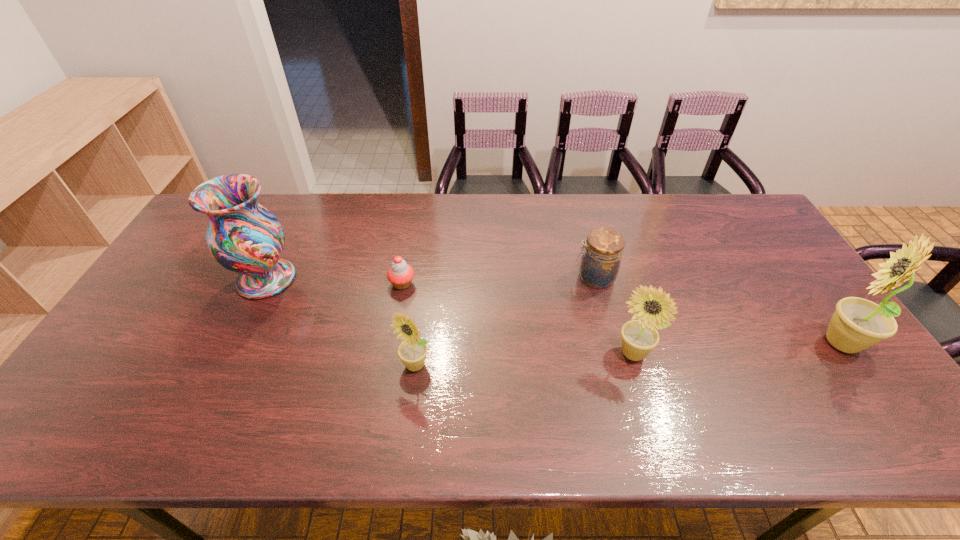
Locate an element on the screen. The image size is (960, 540). vacant area between the second shortest object and the leftmost sunflower is located at coordinates 505,321.

What are the coordinates of `unoccupied position between the second sunflower from left to right and the vase` in the screenshot? It's located at (449, 316).

This screenshot has width=960, height=540. Find the location of `object that can be found as the second closest to the third tallest object`. object that can be found as the second closest to the third tallest object is located at coordinates (857, 324).

At what (x,y) coordinates should I click in order to perform the action: click on object that is the closest one to the vase. Please return your answer as a coordinate pair (x, y). This screenshot has width=960, height=540. Looking at the image, I should click on (400, 274).

Where is `sunflower identified as the second closest to the shortest object`? sunflower identified as the second closest to the shortest object is located at coordinates (652, 308).

This screenshot has height=540, width=960. Identify the location of the second closest sunflower relative to the tallest sunflower. (412, 351).

This screenshot has height=540, width=960. Find the location of `vacant region that satisfies the following two spatial constraints: 1. on the front side of the shortest object; 2. on the right side of the leftmost object`. vacant region that satisfies the following two spatial constraints: 1. on the front side of the shortest object; 2. on the right side of the leftmost object is located at coordinates (264, 284).

This screenshot has width=960, height=540. I want to click on free space that satisfies the following two spatial constraints: 1. on the face of the tallest sunflower; 2. on the face of the leftmost sunflower, so click(x=856, y=365).